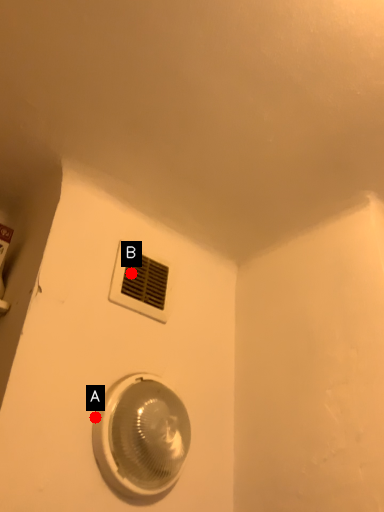
Question: Two points are circled on the image, labeled by A and B beside each circle. Which point is closer to the camera taking this photo?

Choices:
 (A) A is closer
 (B) B is closer

Answer: (A)